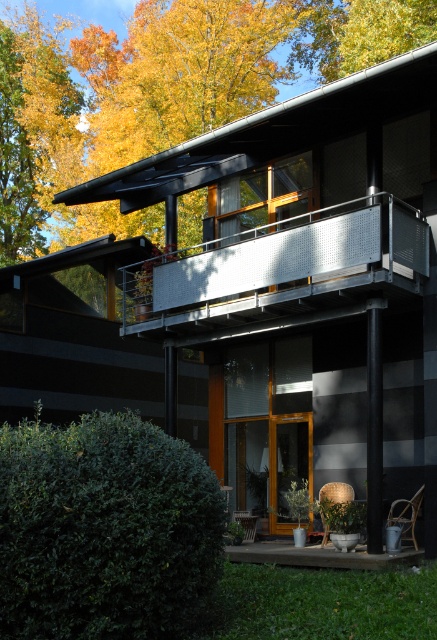
Question: Does metallic silver balcony at upper center appear on the right side of concrete deck at lower center?

Choices:
 (A) no
 (B) yes

Answer: (B)

Question: Is metallic silver balcony at upper center thinner than concrete deck at lower center?

Choices:
 (A) yes
 (B) no

Answer: (A)

Question: Which object is farther from the camera taking this photo?

Choices:
 (A) concrete deck at lower center
 (B) metallic silver balcony at upper center

Answer: (B)

Question: Does metallic silver balcony at upper center appear on the right side of concrete deck at lower center?

Choices:
 (A) yes
 (B) no

Answer: (A)